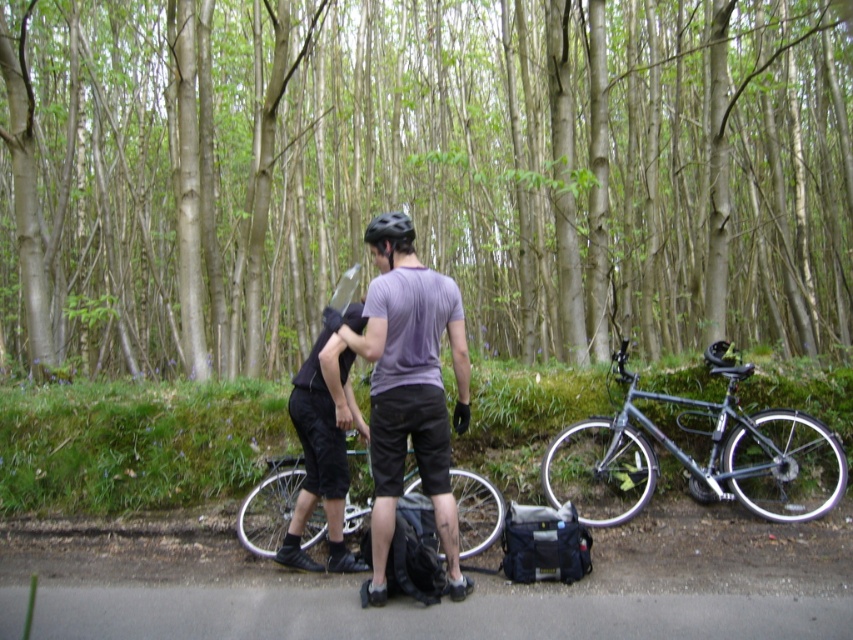
Question: Does green leafy tree at center appear under silver metallic bicycle at center?

Choices:
 (A) yes
 (B) no

Answer: (B)

Question: Which object is farther from the camera taking this photo?

Choices:
 (A) black matte helmet at center
 (B) silver metallic bicycle at center
 (C) metallic silver bicycle at right
 (D) matte purple t-shirt at center

Answer: (C)

Question: Which point appears farthest from the camera in this image?

Choices:
 (A) (364, 230)
 (B) (463, 513)
 (C) (431, 465)
 (D) (624, 378)

Answer: (A)

Question: Which object is farther from the camera taking this photo?

Choices:
 (A) black matte helmet at center
 (B) green leafy tree at center
 (C) metallic silver bicycle at right
 (D) matte purple t-shirt at center

Answer: (B)

Question: Is matte purple t-shirt at center bigger than silver metallic bicycle at center?

Choices:
 (A) no
 (B) yes

Answer: (B)

Question: Is matte purple t-shirt at center in front of black matte helmet at center?

Choices:
 (A) yes
 (B) no

Answer: (A)